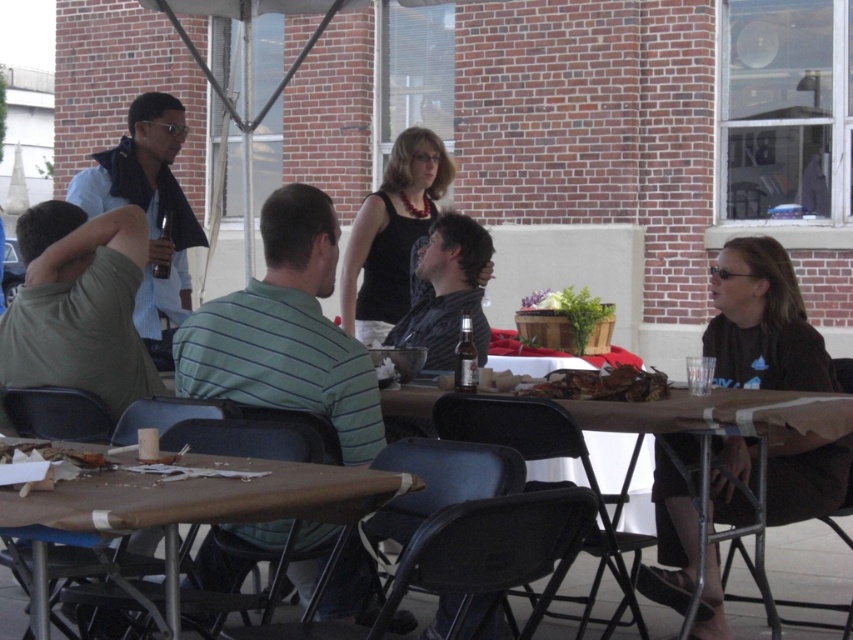
Based on the photo, who is lower down, dark gray shirt at center or crumbly brown paper at lower left?

crumbly brown paper at lower left is lower down.

You are a GUI agent. You are given a task and a screenshot of the screen. Output one action in this format:
    pyautogui.click(x=<x>, y=<y>)
    Task: Click on the dark gray shirt at center
    This screenshot has width=853, height=640.
    Given the screenshot: What is the action you would take?
    pyautogui.click(x=445, y=291)

Does point (697, 625) lie in front of point (431, 177)?

Yes, point (697, 625) is in front of point (431, 177).

Is brown fabric shirt at right taller than black matte tank top at center?

Yes.

Between point (643, 582) and point (421, 227), which one is positioned behind?

Point (421, 227)

The width and height of the screenshot is (853, 640). Identify the location of brown fabric shirt at right. (762, 323).

Can you confirm if light blue shirt at left is bigger than shiny metallic crab at center?

Yes.

Does light blue shirt at left have a greater width compared to shiny metallic crab at center?

Correct, the width of light blue shirt at left exceeds that of shiny metallic crab at center.

At what (x,y) coordinates should I click in order to perform the action: click on light blue shirt at left. Please return your answer as a coordinate pair (x, y). Looking at the image, I should click on (149, 211).

Where is `light blue shirt at left`? The height and width of the screenshot is (640, 853). light blue shirt at left is located at coordinates (149, 211).